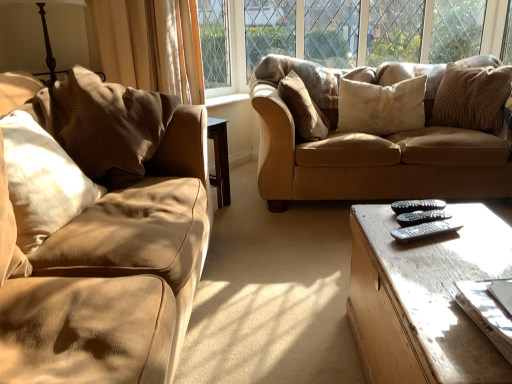
This screenshot has width=512, height=384. Find the location of `vacant space to the left of black plastic remote at center, the 2th remote when ordered from front to back`. vacant space to the left of black plastic remote at center, the 2th remote when ordered from front to back is located at coordinates (379, 220).